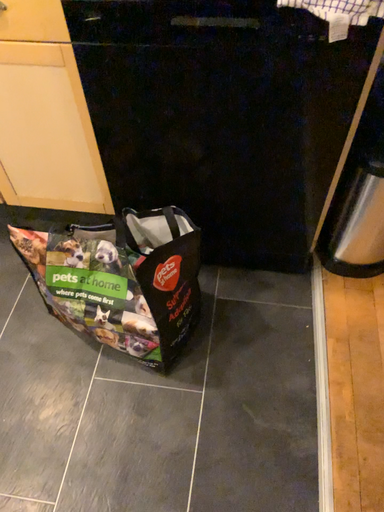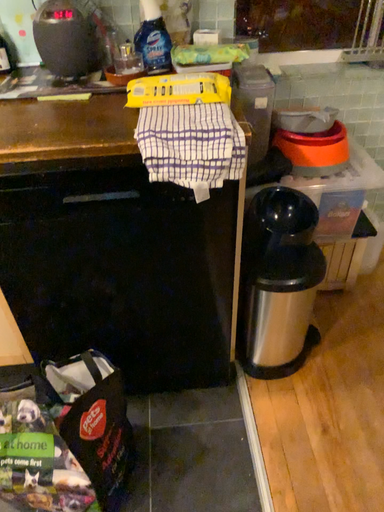
Question: Which way did the camera rotate in the video?

Choices:
 (A) rotated downward
 (B) rotated upward

Answer: (B)